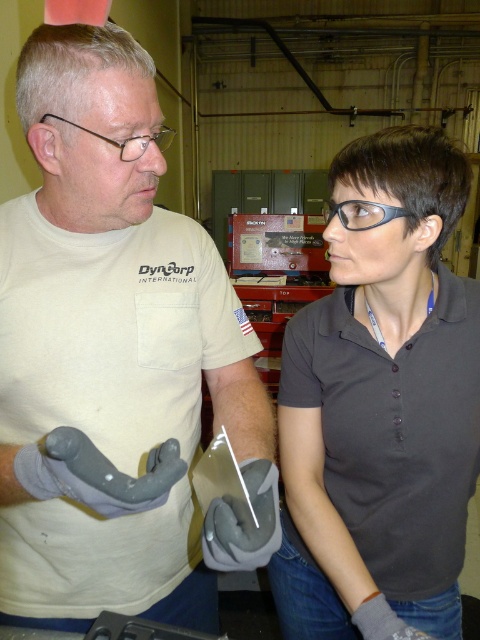
You are a safety inspector in the workshop. You need to determine if the gray rubber gloves at center can be stored in a drawer designed for items narrower than the black plastic glasses at center. Can they fit?

The gray rubber gloves at center are wider than the black plastic glasses at center, so they cannot fit in a drawer designed for items narrower than the black plastic glasses at center.

Consider the image. You are a safety inspector in the workshop. You notice the gray rubber gloves at center and the black plastic glasses at center. Which one is bigger in size?

The gray rubber gloves at center has a larger size compared to the black plastic glasses at center.

You are a safety inspector in the workshop. You need to ensure that the gray rubber gloves at center are properly positioned relative to the dark gray matte shirt at center. Based on the scene, can you confirm if the gloves are correctly placed in front of the shirt?

Yes, the gray rubber gloves at center are correctly positioned in front of the dark gray matte shirt at center as described in the Objects Description.